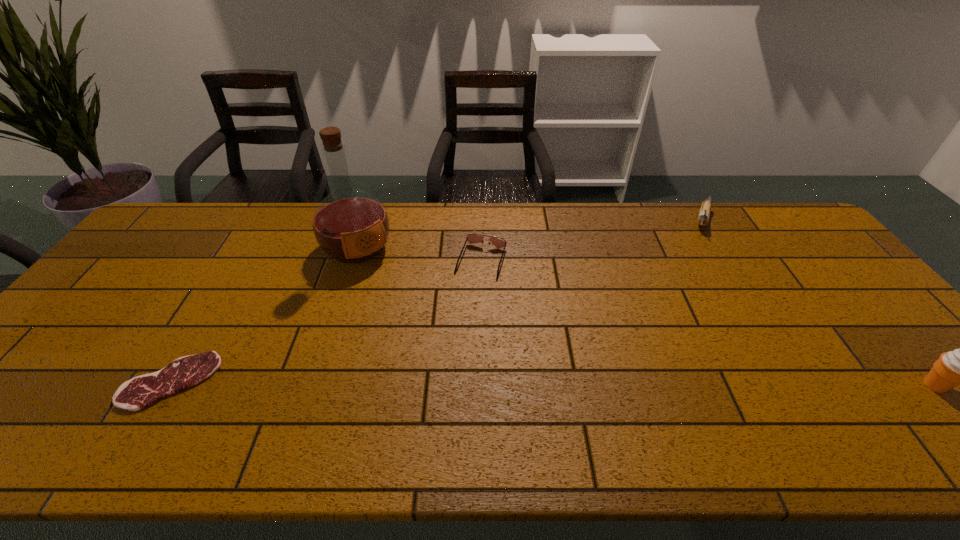
This screenshot has width=960, height=540. I want to click on vacant area that lies between the banana and the fourth object from right to left, so click(x=529, y=234).

Locate an element on the screen. Image resolution: width=960 pixels, height=540 pixels. vacant point located between the second object from right to left and the leftmost object is located at coordinates (436, 300).

Locate an element on the screen. Image resolution: width=960 pixels, height=540 pixels. free space between the sunglasses and the banana is located at coordinates (591, 240).

What are the coordinates of `the fourth closest object to the second tallest object` in the screenshot? It's located at (141, 391).

Identify which object is the fourth closest to the third object from left to right. Please provide its 2D coordinates. Your answer should be formatted as a tuple, i.e. [(x, y)], where the tuple contains the x and y coordinates of a point satisfying the conditions above.

[(958, 367)]

The width and height of the screenshot is (960, 540). I want to click on blank space that satisfies the following two spatial constraints: 1. on the back side of the sunglasses; 2. on the right side of the third tallest object, so click(481, 220).

The height and width of the screenshot is (540, 960). What are the coordinates of `vacant space that satisfies the following two spatial constraints: 1. on the back side of the second object from right to left; 2. on the left side of the liquor` in the screenshot? It's located at (367, 220).